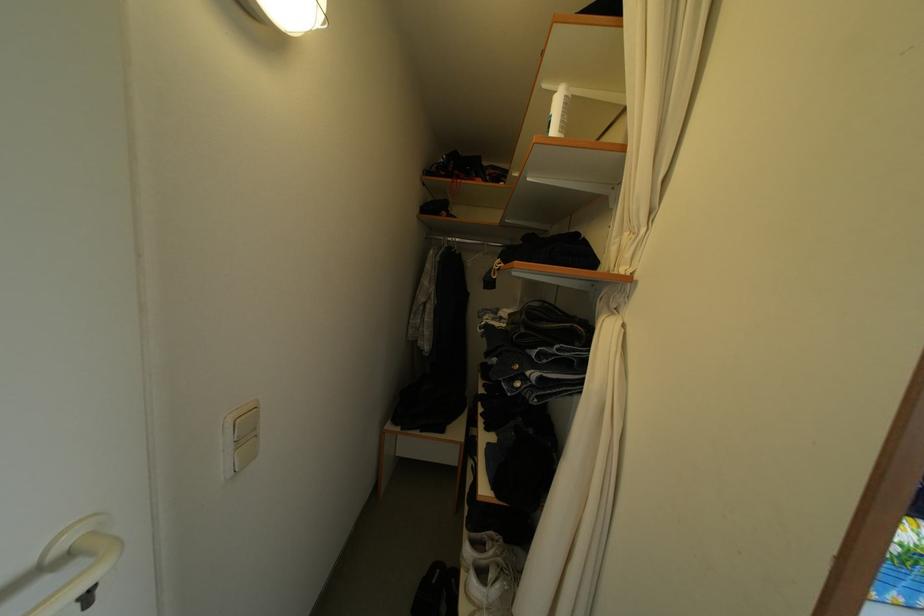
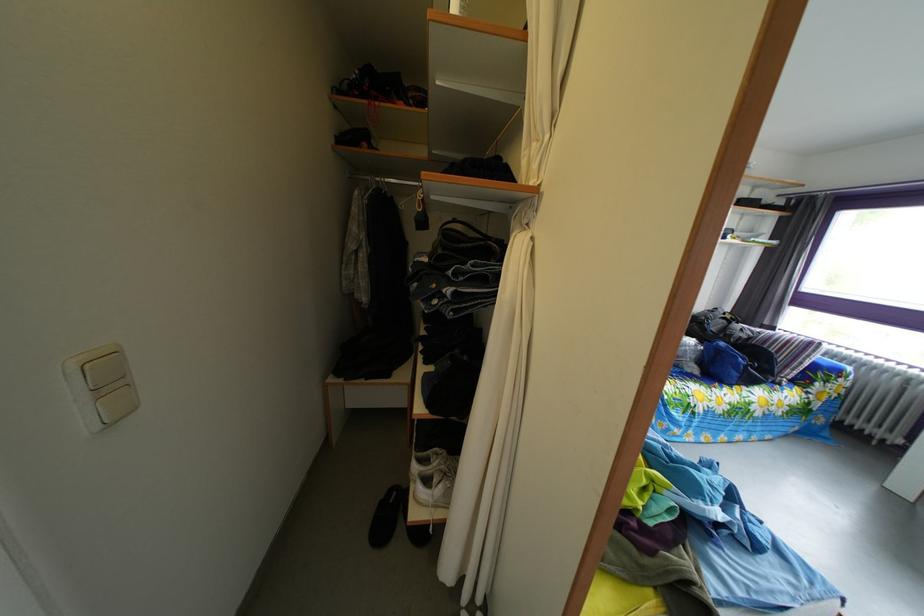
Question: The images are taken continuously from a first-person perspective. In which direction is your viewpoint rotating?

Choices:
 (A) Left
 (B) Right
 (C) Up
 (D) Down

Answer: (B)